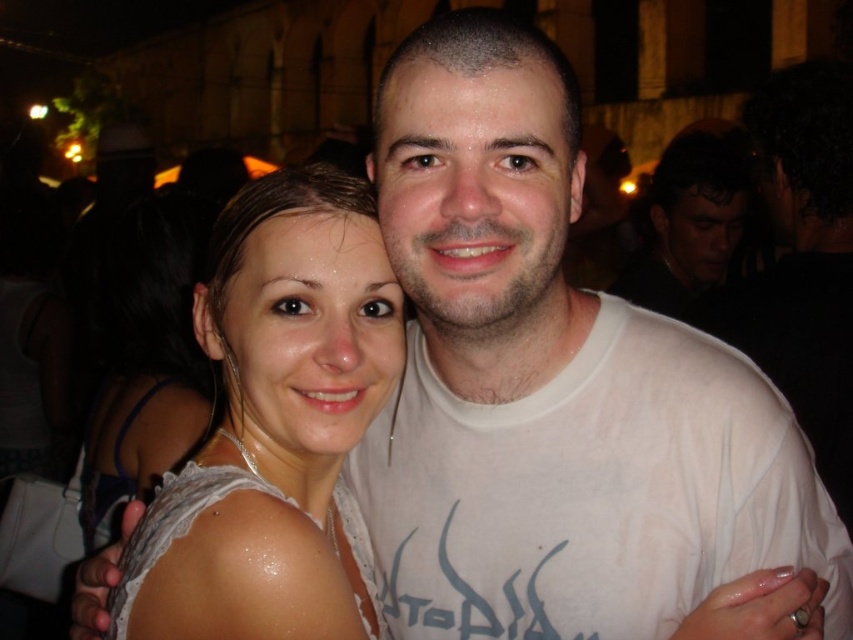
Question: Is white cotton t-shirt at center positioned in front of matte white shirt at center?

Choices:
 (A) no
 (B) yes

Answer: (B)

Question: Which of the following is the farthest from the observer?

Choices:
 (A) matte white shirt at center
 (B) white lace dress at center

Answer: (A)

Question: Is white cotton t-shirt at center below matte white shirt at center?

Choices:
 (A) no
 (B) yes

Answer: (B)

Question: Does white cotton t-shirt at center come in front of matte white shirt at center?

Choices:
 (A) no
 (B) yes

Answer: (B)

Question: Considering the real-world distances, which object is closest to the white lace dress at center?

Choices:
 (A) matte white shirt at center
 (B) white cotton t-shirt at center

Answer: (B)

Question: Which of the following is the closest to the observer?

Choices:
 (A) white lace dress at center
 (B) white cotton t-shirt at center
 (C) matte white shirt at center

Answer: (A)